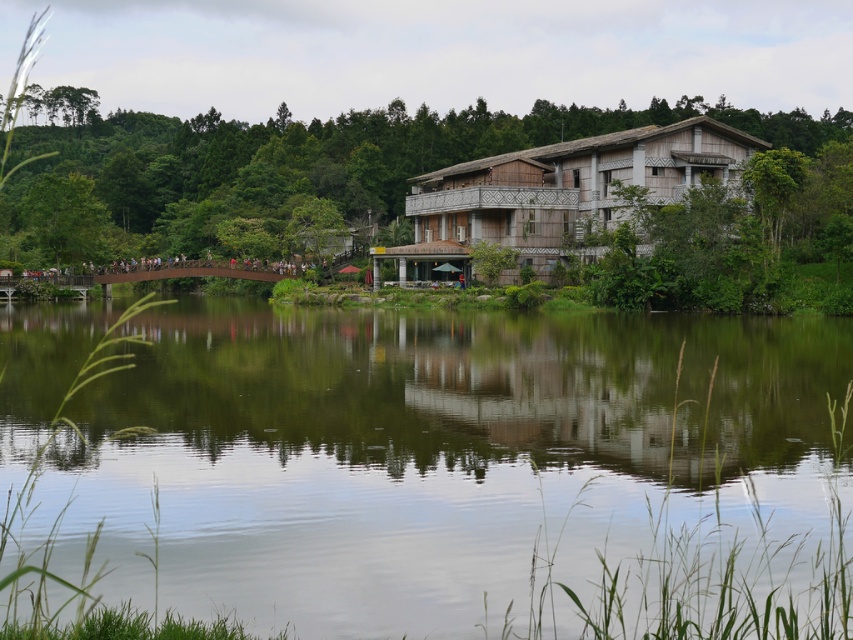
Question: Does green reflective water at center appear on the right side of wooden hut at center?

Choices:
 (A) yes
 (B) no

Answer: (B)

Question: Which of the following is the closest to the observer?

Choices:
 (A) 328,512
 (B) 529,160

Answer: (A)

Question: From the image, what is the correct spatial relationship of green reflective water at center in relation to wooden hut at center?

Choices:
 (A) below
 (B) above

Answer: (A)

Question: Is green reflective water at center to the right of wooden hut at center from the viewer's perspective?

Choices:
 (A) yes
 (B) no

Answer: (B)